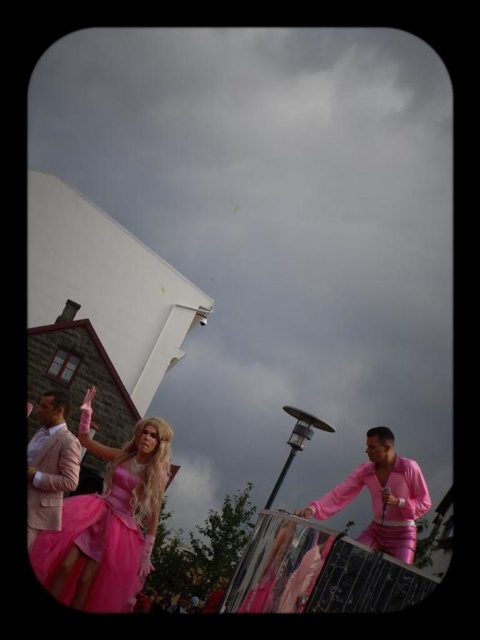
Question: Does shiny pink dress at lower left appear on the left side of matte pink suit at left?

Choices:
 (A) yes
 (B) no

Answer: (B)

Question: Among these objects, which one is farthest from the camera?

Choices:
 (A) matte pink suit at left
 (B) pink satin dress at lower center

Answer: (A)

Question: Which of the following is the closest to the observer?

Choices:
 (A) (312, 508)
 (B) (50, 444)

Answer: (A)

Question: Considering the relative positions of shiny pink dress at lower left and pink satin dress at lower center in the image provided, where is shiny pink dress at lower left located with respect to pink satin dress at lower center?

Choices:
 (A) above
 (B) below

Answer: (B)

Question: Which point appears closest to the camera in this image?

Choices:
 (A) (64, 481)
 (B) (116, 504)

Answer: (A)

Question: Does pink satin dress at lower center have a lesser width compared to matte pink suit at left?

Choices:
 (A) yes
 (B) no

Answer: (B)